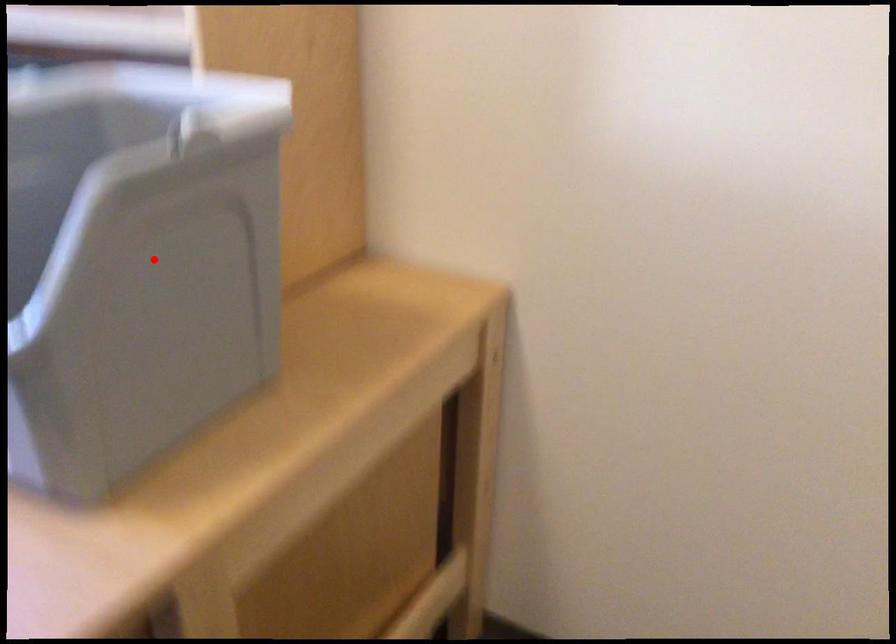
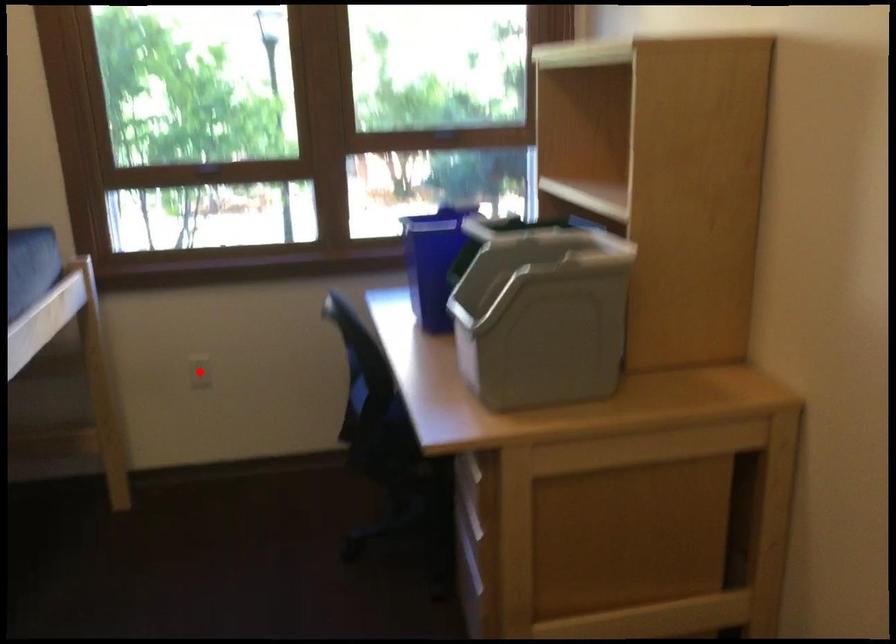
I am providing you with two images of the same scene from different viewpoints. A red point is marked on the first image and another point is marked on the second image. Is the marked point in image1 the same physical position as the marked point in image2?

No